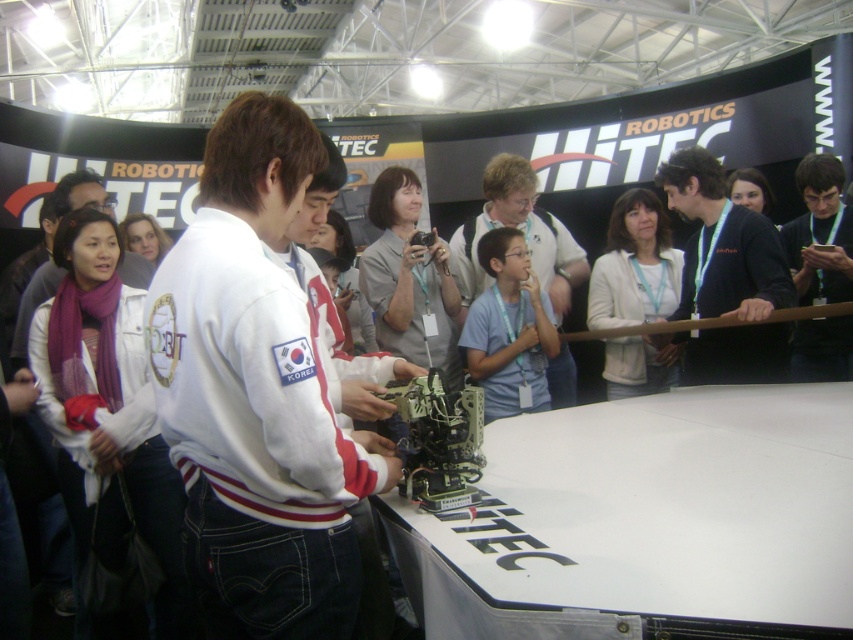
You are organizing a photo shoot and need to decide which clothing item to feature based on size. Given the white fleece jacket at center and the black matte shirt at upper right, which one has a larger width?

The white fleece jacket at center has a larger width than the black matte shirt at upper right according to the description.

Looking at this image, you are at the HiTEC exhibition and notice two people wearing different colored shirts. The white fleece jacket at center and the black matte shirt at upper right. Which one is positioned higher in the image?

The black matte shirt at upper right is positioned higher in the image than the white fleece jacket at center.